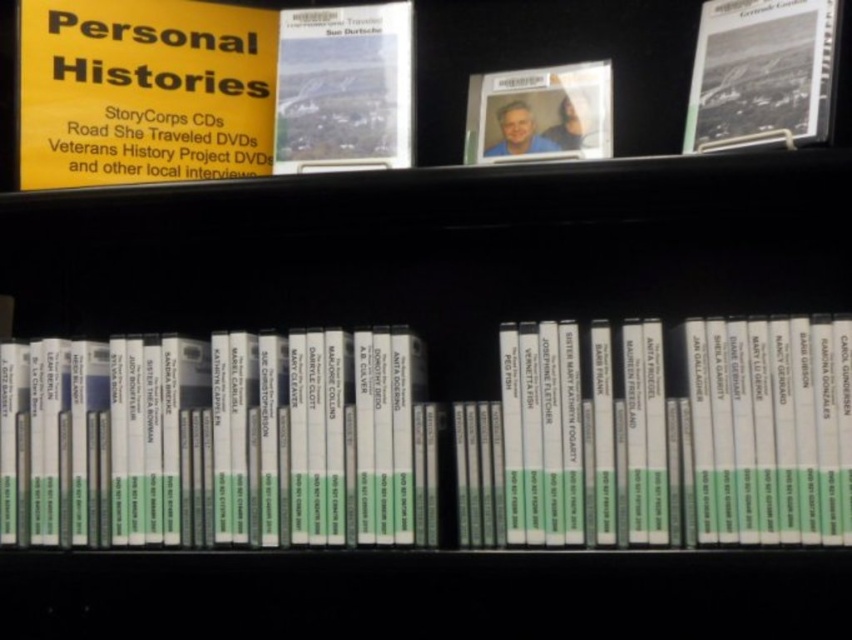
Does white glossy cd cases at center have a greater width compared to matte paper book at upper center?

Yes, white glossy cd cases at center is wider than matte paper book at upper center.

Does white glossy cd cases at center have a larger size compared to matte paper book at upper center?

Indeed, white glossy cd cases at center has a larger size compared to matte paper book at upper center.

Is point (50, 412) in front of point (375, 88)?

Yes, point (50, 412) is closer to viewer.

What are the coordinates of `white glossy cd cases at center` in the screenshot? It's located at (217, 440).

Is white glossy cd cases at center positioned behind yellow paper sign at upper left?

That is False.

Is white glossy cd cases at center smaller than yellow paper sign at upper left?

Actually, white glossy cd cases at center might be larger than yellow paper sign at upper left.

The image size is (852, 640). What are the coordinates of `white glossy cd cases at center` in the screenshot? It's located at (217, 440).

Does matte paper book at upper center appear on the left side of matte plastic photo at center?

Indeed, matte paper book at upper center is positioned on the left side of matte plastic photo at center.

In the scene shown: Between matte paper book at upper center and matte plastic photo at center, which one has less height?

Standing shorter between the two is matte plastic photo at center.

This screenshot has width=852, height=640. What do you see at coordinates (344, 88) in the screenshot?
I see `matte paper book at upper center` at bounding box center [344, 88].

The height and width of the screenshot is (640, 852). I want to click on matte paper book at upper center, so click(344, 88).